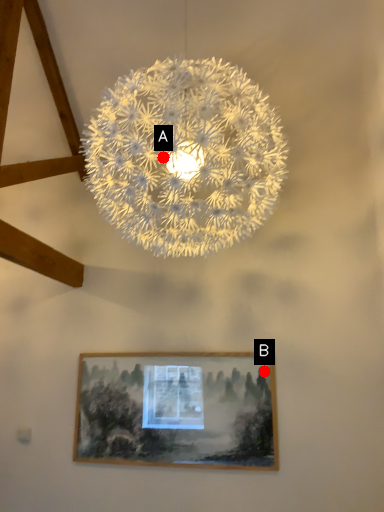
Question: Two points are circled on the image, labeled by A and B beside each circle. Which point is closer to the camera?

Choices:
 (A) A is closer
 (B) B is closer

Answer: (A)